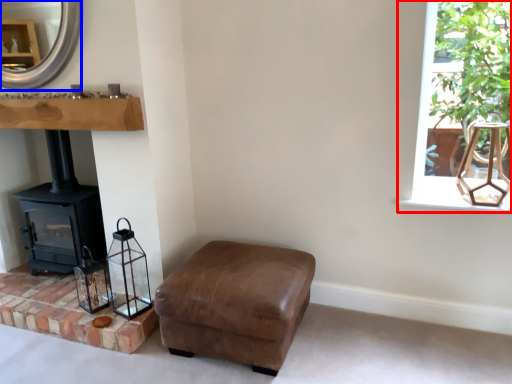
Question: Which of the following is the closest to the observer, window (highlighted by a red box) or fireplace (highlighted by a blue box)?

Choices:
 (A) window
 (B) fireplace

Answer: (A)